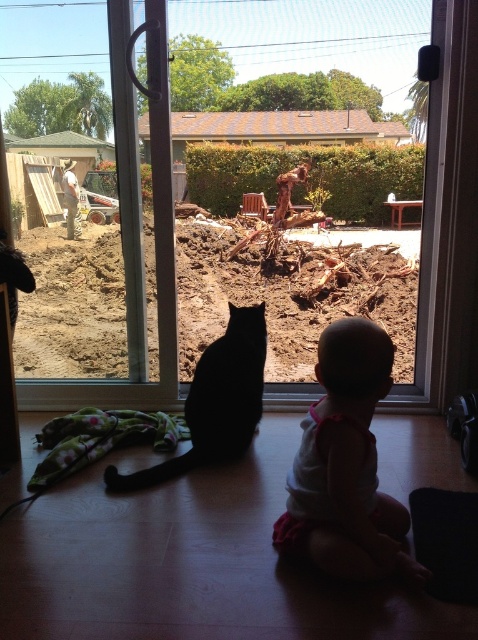
You are a delivery person trying to hand a package to the recipient. You see the white fabric baby at center and the black matte cat at center through the sliding glass door. Which object is closer to the door, indicating where the recipient might be?

The white fabric baby at center is closer to the door than the black matte cat at center, so the recipient is likely near the white fabric baby at center.

You are a delivery robot with a height of 1 meter. You need to deliver a package to the transparent glass window at center. The black matte cat at center is blocking your path. Can you go over the cat to reach the window?

The transparent glass window at center and black matte cat at center are 82.56 centimeters apart from each other. Since the robot is 1 meter tall, it can go over the cat to reach the window as the distance between them is sufficient.